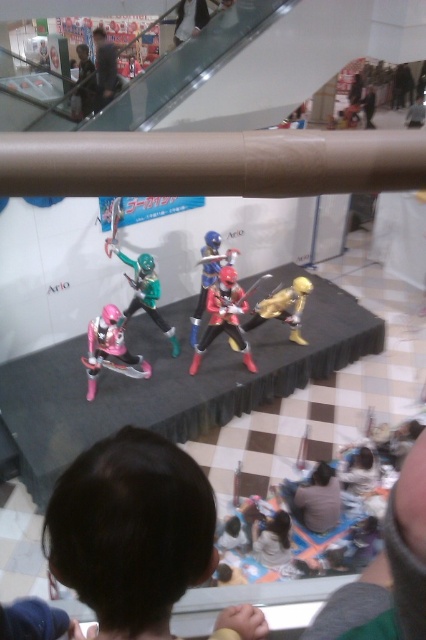
Question: Which of the following is the farthest from the observer?

Choices:
 (A) pink matte action figure at center
 (B) dark blue fabric jacket at upper center

Answer: (B)

Question: Can you confirm if pink matte action figure at center is positioned above dark blue fabric jacket at upper center?

Choices:
 (A) yes
 (B) no

Answer: (B)

Question: Is dark blue fabric jacket at upper center below light brown leather shoes at upper center?

Choices:
 (A) no
 (B) yes

Answer: (B)

Question: Which object appears farthest from the camera in this image?

Choices:
 (A) dark blue fabric jacket at upper center
 (B) dark brown hair at lower center

Answer: (A)

Question: Can you confirm if matte green plastic toy at upper center is positioned to the right of green fabric figure at upper center?

Choices:
 (A) no
 (B) yes

Answer: (B)

Question: Which object is farther from the camera taking this photo?

Choices:
 (A) dark brown hair at lower center
 (B) light brown leather shoes at upper center
 (C) green fabric figure at upper center
 (D) pink matte action figure at center

Answer: (C)